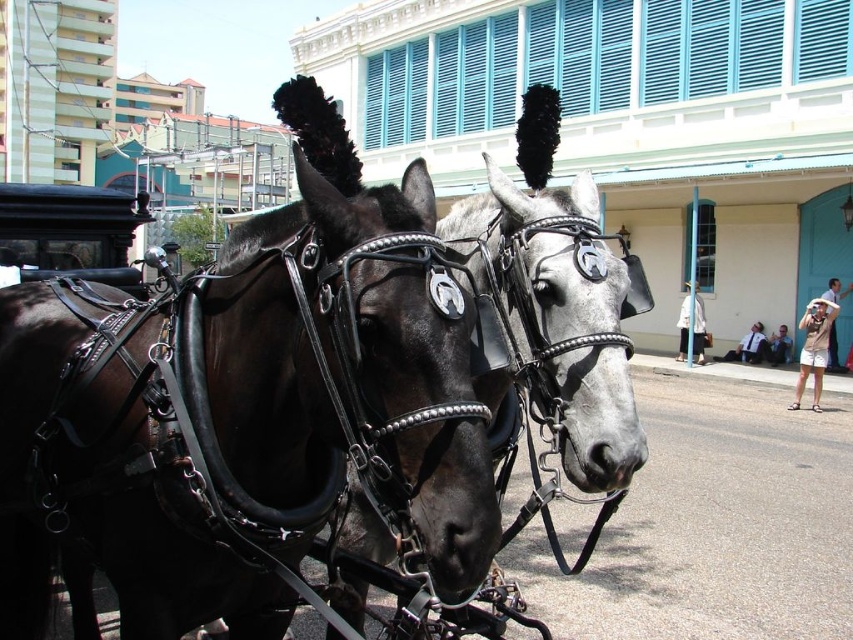
Question: Is tan shorts at lower right further to the viewer compared to light blue denim jacket at lower right?

Choices:
 (A) no
 (B) yes

Answer: (A)

Question: Which object appears farthest from the camera in this image?

Choices:
 (A) tan shorts at lower right
 (B) light blue denim jacket at lower right

Answer: (B)

Question: Can you confirm if shiny black harness at center is bigger than tan shorts at lower right?

Choices:
 (A) yes
 (B) no

Answer: (A)

Question: Which of the following is the farthest from the observer?

Choices:
 (A) (817, 342)
 (B) (235, 355)

Answer: (A)

Question: Does black leather horse at center appear over light blue denim jacket at lower right?

Choices:
 (A) yes
 (B) no

Answer: (A)

Question: Which object is the farthest from the shiny black harness at center?

Choices:
 (A) black leather horse at center
 (B) tan shorts at lower right
 (C) light blue denim jacket at lower right

Answer: (C)